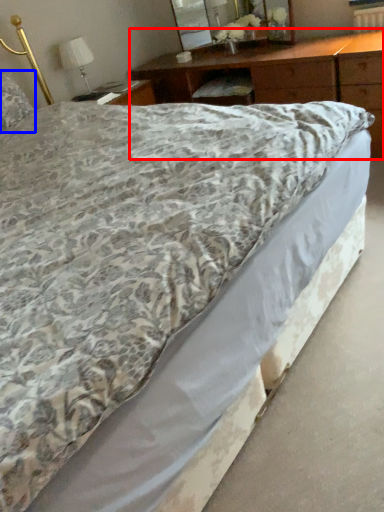
Question: Among these objects, which one is farthest to the camera, nightstand (highlighted by a red box) or pillow (highlighted by a blue box)?

Choices:
 (A) nightstand
 (B) pillow

Answer: (B)